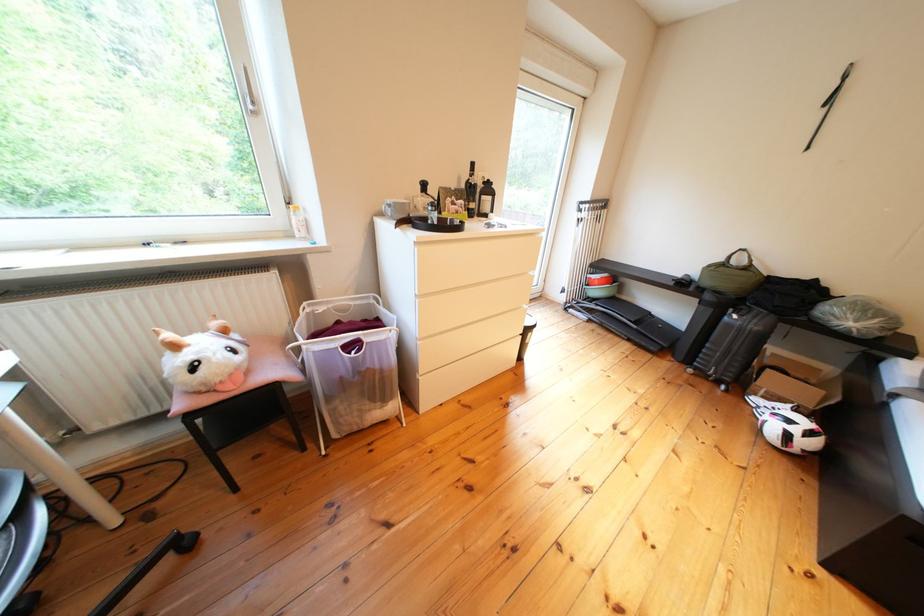
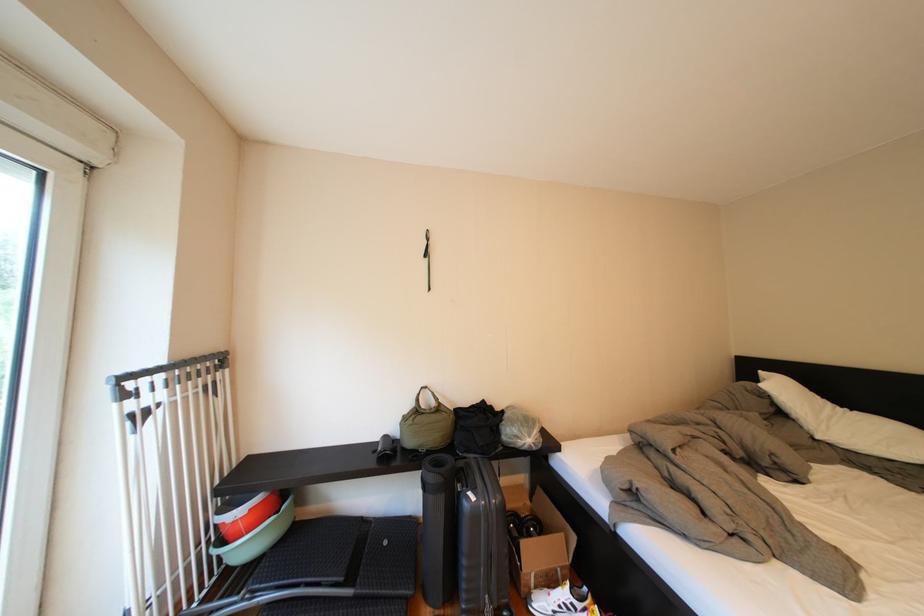
Where in the second image is the point corresponding to (611,296) from the first image?

(261, 551)